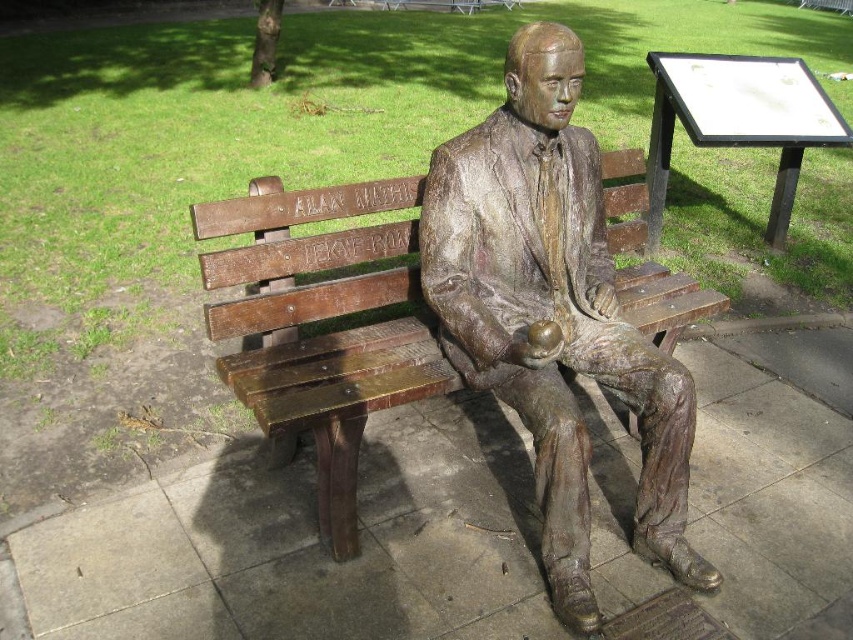
Is bronze statue at center positioned in front of bronze wood bench at center?

Yes.

Does bronze statue at center have a lesser height compared to bronze wood bench at center?

No.

Describe the element at coordinates (553, 314) in the screenshot. This screenshot has height=640, width=853. I see `bronze statue at center` at that location.

The width and height of the screenshot is (853, 640). What are the coordinates of `bronze statue at center` in the screenshot? It's located at (553, 314).